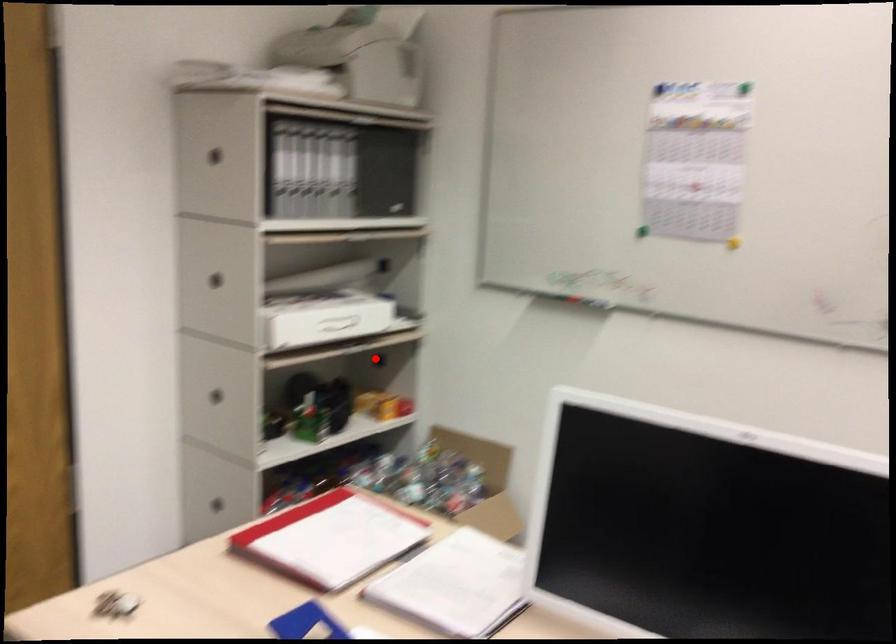
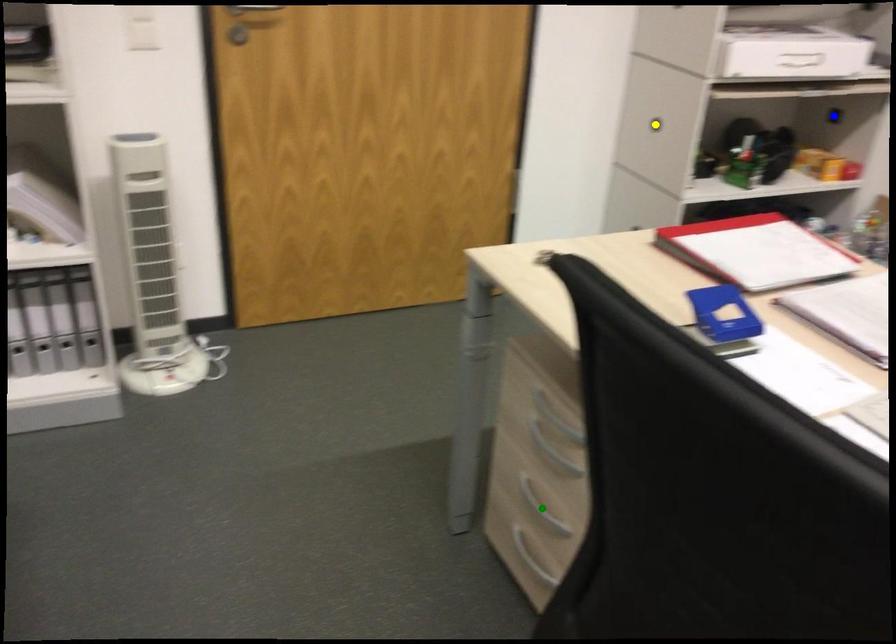
Question: I am providing you with two images of the same scene from different viewpoints. A red point is marked on the first image. You are given multiple points on the second image. In image 2, which mark is for the same physical point as the one in image 1?

Choices:
 (A) blue point
 (B) green point
 (C) yellow point

Answer: (A)